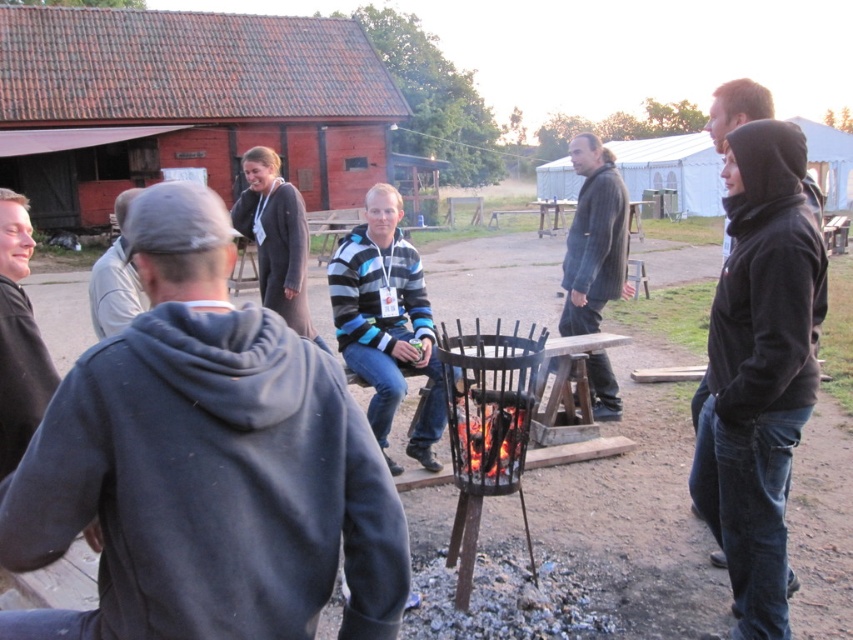
You are at a campsite and need to hand a map to the person wearing the striped sweater at center and the black fleece jacket at right. Which person should you approach first if you want to give the map to the one on the left?

You should approach the person wearing the striped sweater at center first because the striped sweater at center is positioned on the left side of black fleece jacket at right.

From the picture: You are standing at the edge of the fire pit and want to hand a marshmallow to the person wearing the dark gray sweater at center and the person wearing the gray hoodie at center. Can you reach both of them without moving from your current position?

The distance between the dark gray sweater at center and the gray hoodie at center is 4.69 meters. Since you are at the edge of the fire pit, you might not be able to reach both individuals simultaneously without moving, as the distance between them is quite large.